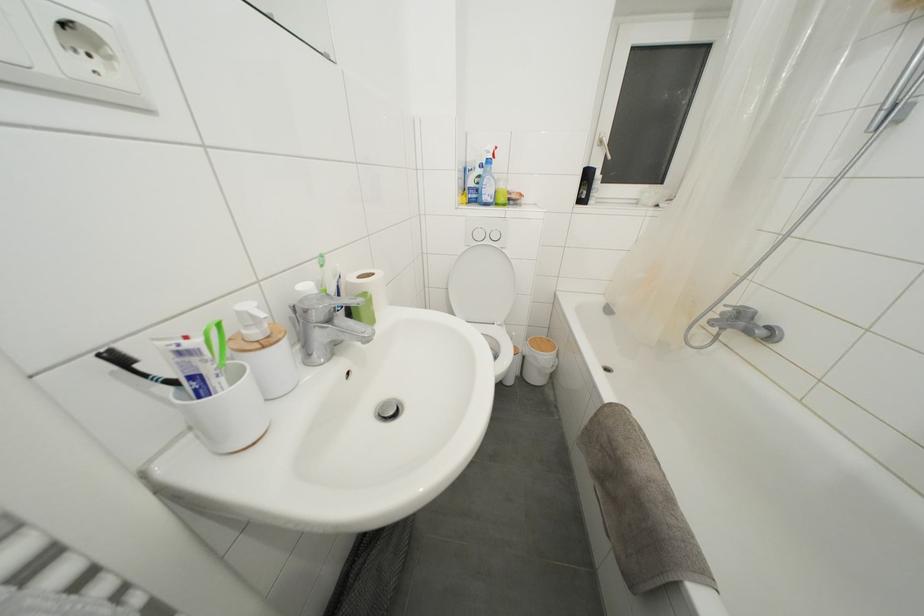
Find where to lift the white toilet lid. Please return your answer as a coordinate pair (x, y).

(481, 285)